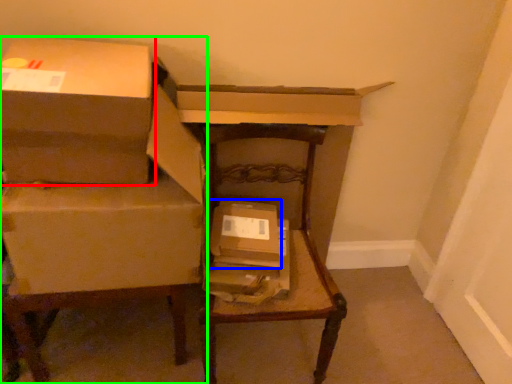
Question: Estimate the real-world distances between objects in this image. Which object is farther from box (highlighted by a red box), box (highlighted by a blue box) or furniture (highlighted by a green box)?

Choices:
 (A) box
 (B) furniture

Answer: (A)